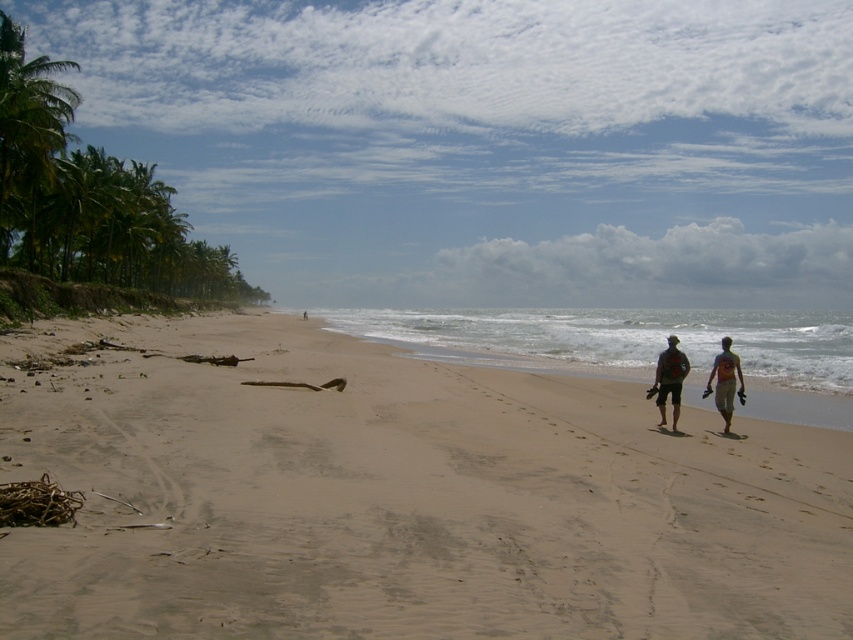
Looking at this image, you are a lifeguard standing at the edge of the beach, and you need to retrieve both the matte red shorts at lower right and the dark gray fabric shorts at lower right. Which pair of shorts should you pick up first if you want to minimize the distance you walk?

You should pick up the matte red shorts at lower right first because they are closer to your starting position at the edge of the beach. The dark gray fabric shorts at lower right are 13.65 inches away from the matte red shorts, meaning they are farther from the edge.